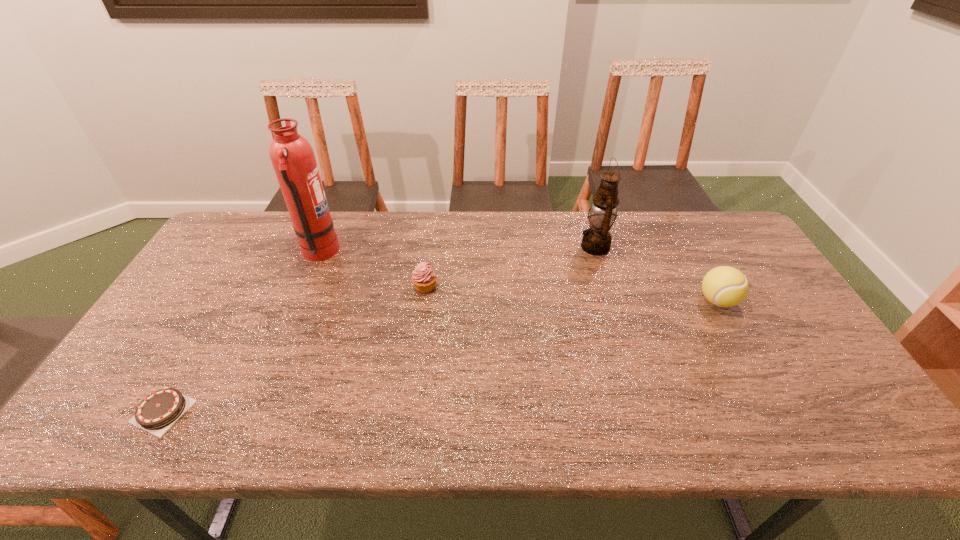
Identify the location of vacant space situated on the label side of the tallest object. (397, 253).

I want to click on free space located on the left of the oil lamp, so click(500, 247).

Locate an element on the screen. This screenshot has width=960, height=540. free space located on the front of the rightmost object is located at coordinates (767, 392).

Locate an element on the screen. vacant region located 0.380m on the left of the cupcake is located at coordinates (284, 287).

This screenshot has width=960, height=540. In order to click on vacant space situated on the back of the shortest object in this screenshot , I will do `click(204, 340)`.

Find the location of a particular element. The height and width of the screenshot is (540, 960). fire extinguisher located at the far edge is located at coordinates (293, 159).

Find the location of a particular element. oil lamp that is at the far edge is located at coordinates (596, 240).

The image size is (960, 540). Find the location of `object present at the near edge`. object present at the near edge is located at coordinates (156, 413).

At what (x,y) coordinates should I click in order to perform the action: click on object present at the left edge. Please return your answer as a coordinate pair (x, y). Looking at the image, I should click on (156, 413).

Identify the location of object present at the right edge. (724, 286).